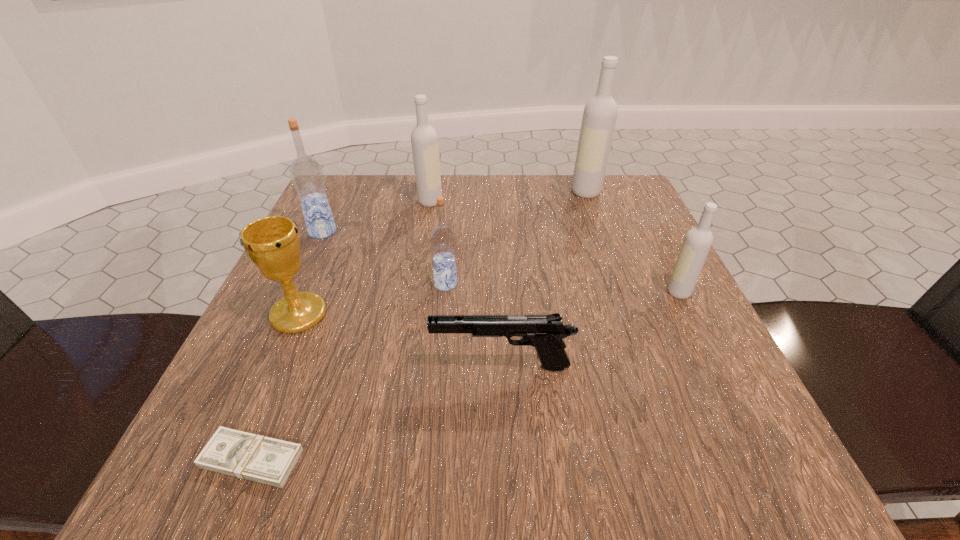
Identify the location of vacant space located 0.150m on the front of the chalice. The height and width of the screenshot is (540, 960). (254, 417).

The height and width of the screenshot is (540, 960). In order to click on vacant space located at the aiming end of the black gun in this screenshot , I will do `click(326, 366)`.

Where is `vacant position located at the aiming end of the black gun`? The image size is (960, 540). vacant position located at the aiming end of the black gun is located at coordinates (386, 366).

Locate an element on the screen. The height and width of the screenshot is (540, 960). vacant region located at the aiming end of the black gun is located at coordinates (293, 366).

Where is `free space located on the back of the shortest object`? The height and width of the screenshot is (540, 960). free space located on the back of the shortest object is located at coordinates [x=312, y=309].

Find the location of `object at the near edge`. object at the near edge is located at coordinates (266, 460).

Where is `vodka located at the left edge`? The height and width of the screenshot is (540, 960). vodka located at the left edge is located at coordinates (306, 173).

Find the location of a particular element. The image size is (960, 540). chalice situated at the left edge is located at coordinates (272, 243).

Find the location of a particular element. money positioned at the left edge is located at coordinates (266, 460).

I want to click on object at the far left corner, so click(306, 173).